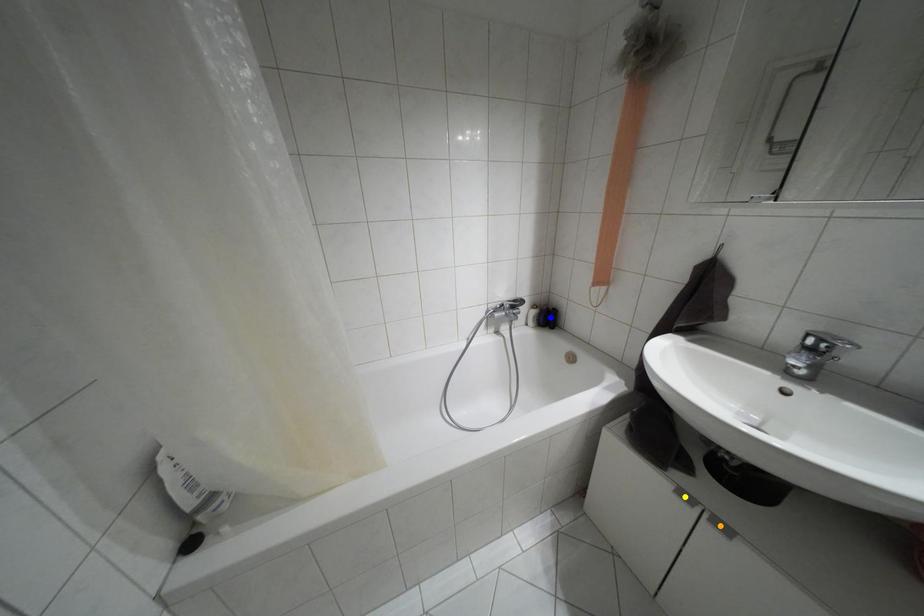
Order these from nearest to farthest:
A) orange point
B) blue point
C) yellow point

orange point < yellow point < blue point